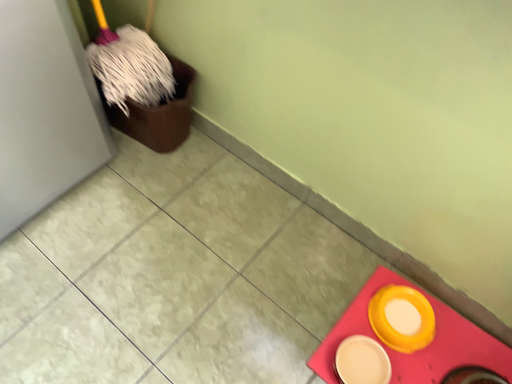
The image size is (512, 384). Describe the element at coordinates (402, 318) in the screenshot. I see `yellow matte bowl at lower right, the first tableware in the right-to-left sequence` at that location.

The height and width of the screenshot is (384, 512). I want to click on matte yellow plate at lower right, which ranks as the 2th tableware in right-to-left order, so click(x=362, y=361).

Describe the element at coordinates (420, 350) in the screenshot. I see `matte yellow bowl at lower right` at that location.

Locate an element on the screen. The height and width of the screenshot is (384, 512). yellow matte bowl at lower right, the first tableware in the right-to-left sequence is located at coordinates (402, 318).

Considering the relative positions of yellow matte bowl at lower right, the 2th tableware from the left, and matte yellow plate at lower right, marked as the 1th tableware in a left-to-right arrangement, in the image provided, is yellow matte bowl at lower right, the 2th tableware from the left, to the left of matte yellow plate at lower right, marked as the 1th tableware in a left-to-right arrangement, from the viewer's perspective?

Incorrect, yellow matte bowl at lower right, the 2th tableware from the left, is not on the left side of matte yellow plate at lower right, marked as the 1th tableware in a left-to-right arrangement.

From the image's perspective, is yellow matte bowl at lower right, the first tableware in the right-to-left sequence, beneath matte yellow plate at lower right, which ranks as the 2th tableware in right-to-left order?

Incorrect, from the image's perspective, yellow matte bowl at lower right, the first tableware in the right-to-left sequence, is higher than matte yellow plate at lower right, which ranks as the 2th tableware in right-to-left order.

You are a GUI agent. You are given a task and a screenshot of the screen. Output one action in this format:
    pyautogui.click(x=<x>, y=<y>)
    Task: Click on the tableware behind the matte yellow plate at lower right, marked as the 1th tableware in a left-to-right arrangement
    This screenshot has width=512, height=384.
    Given the screenshot: What is the action you would take?
    pyautogui.click(x=402, y=318)

Is matte yellow plate at lower right, which ranks as the 2th tableware in right-to-left order, at the back of yellow matte bowl at lower right, the 2th tableware from the left?

No, yellow matte bowl at lower right, the 2th tableware from the left, is not facing away from matte yellow plate at lower right, which ranks as the 2th tableware in right-to-left order.

From the image's perspective, is matte yellow bowl at lower right below matte yellow plate at lower right, which ranks as the 2th tableware in right-to-left order?

Yes, from the image's perspective, matte yellow bowl at lower right is below matte yellow plate at lower right, which ranks as the 2th tableware in right-to-left order.

Locate an element on the screen. tile that is under the matte yellow plate at lower right, which ranks as the 2th tableware in right-to-left order (from a real-world perspective) is located at coordinates (420, 350).

Is matte yellow bowl at lower right far away from matte yellow plate at lower right, marked as the 1th tableware in a left-to-right arrangement?

matte yellow bowl at lower right is near matte yellow plate at lower right, marked as the 1th tableware in a left-to-right arrangement, not far away.

How different are the orientations of matte yellow plate at lower right, which ranks as the 2th tableware in right-to-left order, and yellow matte bowl at lower right, the first tableware in the right-to-left sequence, in degrees?

1.87 degrees.

From the image's perspective, is matte yellow plate at lower right, marked as the 1th tableware in a left-to-right arrangement, on top of yellow matte bowl at lower right, the first tableware in the right-to-left sequence?

No, from the image's perspective, matte yellow plate at lower right, marked as the 1th tableware in a left-to-right arrangement, is not on top of yellow matte bowl at lower right, the first tableware in the right-to-left sequence.

Which object is positioned more to the right, matte yellow plate at lower right, marked as the 1th tableware in a left-to-right arrangement, or yellow matte bowl at lower right, the first tableware in the right-to-left sequence?

yellow matte bowl at lower right, the first tableware in the right-to-left sequence, is more to the right.

Considering the sizes of objects matte yellow plate at lower right, marked as the 1th tableware in a left-to-right arrangement, and yellow matte bowl at lower right, the first tableware in the right-to-left sequence, in the image provided, who is smaller, matte yellow plate at lower right, marked as the 1th tableware in a left-to-right arrangement, or yellow matte bowl at lower right, the first tableware in the right-to-left sequence,?

matte yellow plate at lower right, marked as the 1th tableware in a left-to-right arrangement.

From the image's perspective, which object appears higher, matte yellow bowl at lower right or yellow matte bowl at lower right, the first tableware in the right-to-left sequence?

yellow matte bowl at lower right, the first tableware in the right-to-left sequence.

From the picture: In terms of height, does matte yellow bowl at lower right look taller or shorter compared to yellow matte bowl at lower right, the 2th tableware from the left?

In the image, matte yellow bowl at lower right appears to be shorter than yellow matte bowl at lower right, the 2th tableware from the left.

Consider the image. From a real-world perspective, which is physically above, matte yellow bowl at lower right or yellow matte bowl at lower right, the 2th tableware from the left?

From a 3D spatial view, yellow matte bowl at lower right, the 2th tableware from the left, is above.

Would you say matte yellow bowl at lower right is a long distance from yellow matte bowl at lower right, the first tableware in the right-to-left sequence?

They are positioned close to each other.

Considering the sizes of objects yellow matte bowl at lower right, the 2th tableware from the left, and matte yellow bowl at lower right in the image provided, who is shorter, yellow matte bowl at lower right, the 2th tableware from the left, or matte yellow bowl at lower right?

With less height is matte yellow bowl at lower right.

In the scene shown: Is yellow matte bowl at lower right, the 2th tableware from the left, turned away from matte yellow bowl at lower right?

No, yellow matte bowl at lower right, the 2th tableware from the left, is not facing the opposite direction of matte yellow bowl at lower right.

Is point (413, 319) closer or farther from the camera than point (358, 294)?

Point (413, 319) is closer to the camera than point (358, 294).

Could matte yellow bowl at lower right be considered to be inside yellow matte bowl at lower right, the first tableware in the right-to-left sequence?

No, matte yellow bowl at lower right is not surrounded by yellow matte bowl at lower right, the first tableware in the right-to-left sequence.

Which object is wider, matte yellow plate at lower right, marked as the 1th tableware in a left-to-right arrangement, or matte yellow bowl at lower right?

With larger width is matte yellow bowl at lower right.

From the image's perspective, is matte yellow plate at lower right, marked as the 1th tableware in a left-to-right arrangement, above or below matte yellow bowl at lower right?

Based on their image positions, matte yellow plate at lower right, marked as the 1th tableware in a left-to-right arrangement, is located above matte yellow bowl at lower right.

In the scene shown: Is matte yellow plate at lower right, marked as the 1th tableware in a left-to-right arrangement, touching matte yellow bowl at lower right?

matte yellow plate at lower right, marked as the 1th tableware in a left-to-right arrangement, is not next to matte yellow bowl at lower right, and they're not touching.

At what (x,y) coordinates should I click in order to perform the action: click on tile below the matte yellow plate at lower right, marked as the 1th tableware in a left-to-right arrangement (from a real-world perspective). Please return your answer as a coordinate pair (x, y). The width and height of the screenshot is (512, 384). Looking at the image, I should click on (420, 350).

At what (x,y) coordinates should I click in order to perform the action: click on tableware behind the matte yellow plate at lower right, which ranks as the 2th tableware in right-to-left order. Please return your answer as a coordinate pair (x, y). This screenshot has height=384, width=512. Looking at the image, I should click on (402, 318).

Locate an element on the screen. Image resolution: width=512 pixels, height=384 pixels. tile in front of the matte yellow plate at lower right, which ranks as the 2th tableware in right-to-left order is located at coordinates (420, 350).

Which object lies further to the anchor point matte yellow plate at lower right, which ranks as the 2th tableware in right-to-left order, matte yellow bowl at lower right or yellow matte bowl at lower right, the 2th tableware from the left?

Based on the image, matte yellow bowl at lower right appears to be further to matte yellow plate at lower right, which ranks as the 2th tableware in right-to-left order.

Which object lies nearer to the anchor point matte yellow plate at lower right, marked as the 1th tableware in a left-to-right arrangement, yellow matte bowl at lower right, the first tableware in the right-to-left sequence, or matte yellow bowl at lower right?

yellow matte bowl at lower right, the first tableware in the right-to-left sequence, is closer to matte yellow plate at lower right, marked as the 1th tableware in a left-to-right arrangement.

Which object lies nearer to the anchor point yellow matte bowl at lower right, the first tableware in the right-to-left sequence, matte yellow bowl at lower right or matte yellow plate at lower right, marked as the 1th tableware in a left-to-right arrangement?

matte yellow bowl at lower right is closer to yellow matte bowl at lower right, the first tableware in the right-to-left sequence.

Based on the photo, when comparing their distances from matte yellow bowl at lower right, does yellow matte bowl at lower right, the first tableware in the right-to-left sequence, or matte yellow plate at lower right, marked as the 1th tableware in a left-to-right arrangement, seem further?

The object further to matte yellow bowl at lower right is matte yellow plate at lower right, marked as the 1th tableware in a left-to-right arrangement.

Consider the image. Which object lies nearer to the anchor point matte yellow bowl at lower right, matte yellow plate at lower right, which ranks as the 2th tableware in right-to-left order, or yellow matte bowl at lower right, the 2th tableware from the left?

Based on the image, yellow matte bowl at lower right, the 2th tableware from the left, appears to be nearer to matte yellow bowl at lower right.

From the image, which object appears to be farther from yellow matte bowl at lower right, the 2th tableware from the left, matte yellow plate at lower right, which ranks as the 2th tableware in right-to-left order, or matte yellow bowl at lower right?

Based on the image, matte yellow plate at lower right, which ranks as the 2th tableware in right-to-left order, appears to be further to yellow matte bowl at lower right, the 2th tableware from the left.

Find the location of a particular element. tableware between matte yellow plate at lower right, marked as the 1th tableware in a left-to-right arrangement, and matte yellow bowl at lower right is located at coordinates (402, 318).